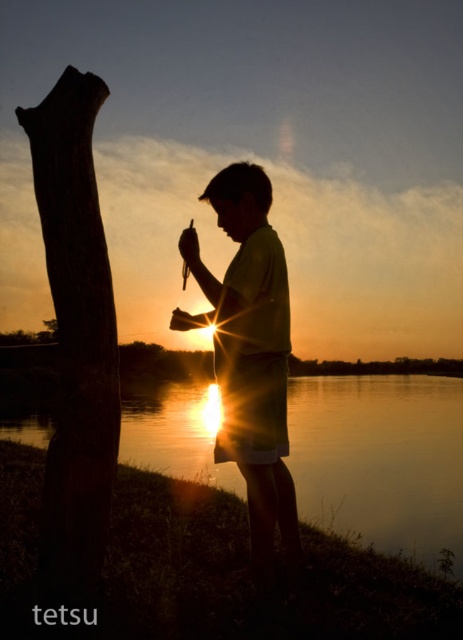
Question: Can you confirm if dark brown rough tree trunk at left is positioned to the left of silhouette fabric at center?

Choices:
 (A) yes
 (B) no

Answer: (A)

Question: Which object is the farthest from the dark brown rough tree trunk at left?

Choices:
 (A) glistening water at lower center
 (B) silhouette fabric at center

Answer: (A)

Question: Which point is farther from the camera taking this photo?

Choices:
 (A) pyautogui.click(x=225, y=467)
 (B) pyautogui.click(x=56, y=436)
 (C) pyautogui.click(x=275, y=408)

Answer: (A)

Question: Is glistening water at lower center further to the viewer compared to silhouette fabric at center?

Choices:
 (A) no
 (B) yes

Answer: (B)

Question: Which object is positioned closest to the dark brown rough tree trunk at left?

Choices:
 (A) silhouette fabric at center
 (B) glistening water at lower center

Answer: (A)

Question: Does dark brown rough tree trunk at left come behind silhouette fabric at center?

Choices:
 (A) no
 (B) yes

Answer: (A)